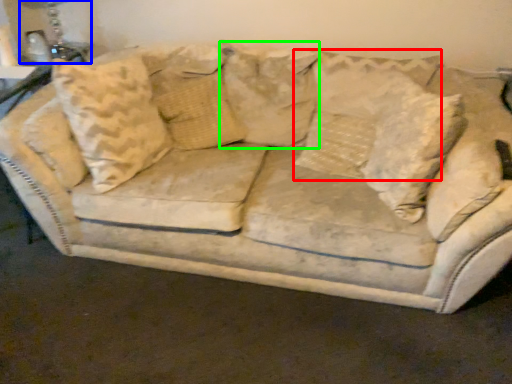
Question: Which object is positioned farthest from pillow (highlighted by a red box)? Select from table lamp (highlighted by a blue box) and pillow (highlighted by a green box).

Choices:
 (A) table lamp
 (B) pillow

Answer: (A)